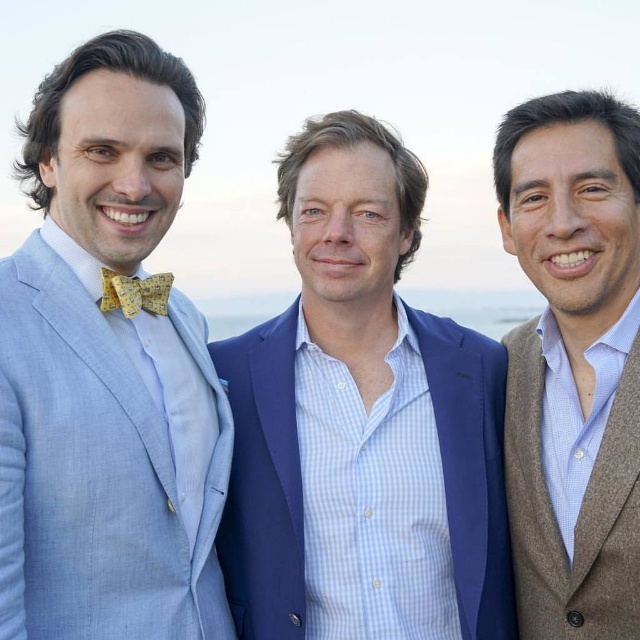
Does light blue linen suit at left appear on the right side of brown wool sweater at right?

No, light blue linen suit at left is not to the right of brown wool sweater at right.

Is point (198, 508) more distant than point (636, 424)?

Yes.

This screenshot has height=640, width=640. Identify the location of light blue linen suit at left. [x=108, y=369].

Image resolution: width=640 pixels, height=640 pixels. What are the coordinates of `light blue linen suit at left` in the screenshot? It's located at (108, 369).

Can you confirm if light blue linen suit at left is positioned to the right of blue textured suit at center?

No, light blue linen suit at left is not to the right of blue textured suit at center.

Who is more forward, (163, 541) or (371, 250)?

Point (163, 541) is more forward.

Where is `light blue linen suit at left`? light blue linen suit at left is located at coordinates (108, 369).

Between point (618, 481) and point (125, 305), which one is positioned behind?

Point (125, 305)

Which is in front, point (570, 580) or point (108, 305)?

Point (108, 305) is in front.

Is point (596, 202) more distant than point (147, 276)?

No.

Locate an element on the screen. Image resolution: width=640 pixels, height=640 pixels. brown wool sweater at right is located at coordinates (573, 362).